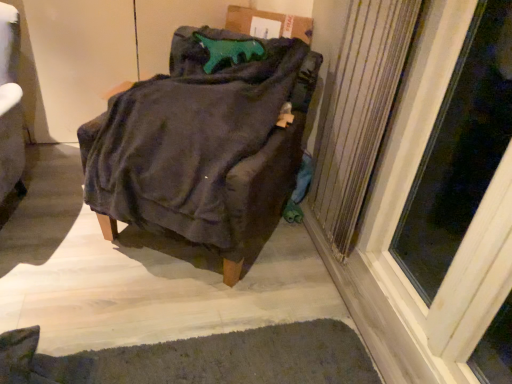
Where is `transparent glass screen door at right`? The width and height of the screenshot is (512, 384). transparent glass screen door at right is located at coordinates (459, 151).

Find the location of a particular element. The width and height of the screenshot is (512, 384). velvety dark gray chair at center is located at coordinates (203, 144).

What do you see at coordinates (226, 359) in the screenshot? I see `dark gray textured mat at lower center` at bounding box center [226, 359].

Measure the distance between point [362,356] and camera.

They are 5.07 feet apart.

Where is `metallic silver radiator at right`? The height and width of the screenshot is (384, 512). metallic silver radiator at right is located at coordinates (358, 111).

How far apart are metallic silver radiator at right and dark gray textured mat at lower center?

A distance of 82.84 centimeters exists between metallic silver radiator at right and dark gray textured mat at lower center.

From the image's perspective, which one is positioned higher, metallic silver radiator at right or dark gray textured mat at lower center?

metallic silver radiator at right appears higher in the image.

Locate an element on the screen. radiator lying on the right of dark gray textured mat at lower center is located at coordinates (358, 111).

From the picture: How different are the orientations of metallic silver radiator at right and dark gray textured mat at lower center in degrees?

0.852 degrees.

How different are the orientations of velvety dark gray chair at center and transparent glass screen door at right in degrees?

velvety dark gray chair at center and transparent glass screen door at right are facing 55.3 degrees away from each other.

From a real-world perspective, is velvety dark gray chair at center on top of transparent glass screen door at right?

Actually, velvety dark gray chair at center is physically below transparent glass screen door at right in the real world.

From the image's perspective, is velvety dark gray chair at center beneath transparent glass screen door at right?

No, from the image's perspective, velvety dark gray chair at center is not below transparent glass screen door at right.

Considering the relative positions of velvety dark gray chair at center and transparent glass screen door at right in the image provided, is velvety dark gray chair at center behind transparent glass screen door at right?

Yes, it is.

Considering the relative sizes of dark gray textured mat at lower center and metallic silver radiator at right in the image provided, is dark gray textured mat at lower center taller than metallic silver radiator at right?

In fact, dark gray textured mat at lower center may be shorter than metallic silver radiator at right.

Can you confirm if dark gray textured mat at lower center is thinner than metallic silver radiator at right?

Incorrect, the width of dark gray textured mat at lower center is not less than that of metallic silver radiator at right.

Considering the relative sizes of dark gray textured mat at lower center and metallic silver radiator at right in the image provided, is dark gray textured mat at lower center bigger than metallic silver radiator at right?

Incorrect, dark gray textured mat at lower center is not larger than metallic silver radiator at right.

The width and height of the screenshot is (512, 384). I want to click on doormat below the metallic silver radiator at right (from a real-world perspective), so click(x=226, y=359).

Image resolution: width=512 pixels, height=384 pixels. I want to click on furniture on the left of dark gray textured mat at lower center, so click(203, 144).

Can you tell me how much dark gray textured mat at lower center and velvety dark gray chair at center differ in facing direction?

56.2 degrees.

From the picture: Which is more to the left, dark gray textured mat at lower center or velvety dark gray chair at center?

Positioned to the left is velvety dark gray chair at center.

From a real-world perspective, is dark gray textured mat at lower center physically below velvety dark gray chair at center?

Indeed, from a real-world perspective, dark gray textured mat at lower center is positioned beneath velvety dark gray chair at center.

Between metallic silver radiator at right and transparent glass screen door at right, which one has smaller width?

With smaller width is transparent glass screen door at right.

Which is farther, (397,3) or (490,29)?

The point (490,29) is farther.

This screenshot has width=512, height=384. I want to click on radiator that appears on the left of transparent glass screen door at right, so click(x=358, y=111).

Would you consider metallic silver radiator at right to be distant from transparent glass screen door at right?

No, there isn't a large distance between metallic silver radiator at right and transparent glass screen door at right.

Is transparent glass screen door at right at the right side of velvety dark gray chair at center?

Yes.

At what (x,y) coordinates should I click in order to perform the action: click on screen door in front of the velvety dark gray chair at center. Please return your answer as a coordinate pair (x, y). This screenshot has width=512, height=384. Looking at the image, I should click on (459, 151).

Is transparent glass screen door at right not near velvety dark gray chair at center?

No.

Which object is thinner, transparent glass screen door at right or velvety dark gray chair at center?

transparent glass screen door at right.

Is dark gray textured mat at lower center at the back of velvety dark gray chair at center?

No.

Visually, is velvety dark gray chair at center positioned to the left or to the right of dark gray textured mat at lower center?

From the image, it's evident that velvety dark gray chair at center is to the left of dark gray textured mat at lower center.

Does velvety dark gray chair at center have a smaller size compared to dark gray textured mat at lower center?

No.

Is velvety dark gray chair at center wider than dark gray textured mat at lower center?

In fact, velvety dark gray chair at center might be narrower than dark gray textured mat at lower center.

Find the location of a particular element. doormat that is in front of the metallic silver radiator at right is located at coordinates (226, 359).

At what (x,y) coordinates should I click in order to perform the action: click on furniture above the transparent glass screen door at right (from the image's perspective). Please return your answer as a coordinate pair (x, y). The width and height of the screenshot is (512, 384). Looking at the image, I should click on (203, 144).

Considering their positions, is dark gray textured mat at lower center positioned further to metallic silver radiator at right than transparent glass screen door at right?

dark gray textured mat at lower center is positioned further to the anchor metallic silver radiator at right.

Based on their spatial positions, is metallic silver radiator at right or dark gray textured mat at lower center further from velvety dark gray chair at center?

Based on the image, dark gray textured mat at lower center appears to be further to velvety dark gray chair at center.

Based on their spatial positions, is transparent glass screen door at right or velvety dark gray chair at center closer to metallic silver radiator at right?

transparent glass screen door at right is closer to metallic silver radiator at right.

From the image, which object appears to be farther from metallic silver radiator at right, dark gray textured mat at lower center or velvety dark gray chair at center?

Among the two, dark gray textured mat at lower center is located further to metallic silver radiator at right.

Estimate the real-world distances between objects in this image. Which object is further from transparent glass screen door at right, dark gray textured mat at lower center or metallic silver radiator at right?

dark gray textured mat at lower center lies further to transparent glass screen door at right than the other object.

When comparing their distances from dark gray textured mat at lower center, does velvety dark gray chair at center or transparent glass screen door at right seem closer?

velvety dark gray chair at center lies closer to dark gray textured mat at lower center than the other object.

Considering their positions, is velvety dark gray chair at center positioned closer to metallic silver radiator at right than transparent glass screen door at right?

transparent glass screen door at right is closer to metallic silver radiator at right.

Considering their positions, is velvety dark gray chair at center positioned further to dark gray textured mat at lower center than metallic silver radiator at right?

metallic silver radiator at right lies further to dark gray textured mat at lower center than the other object.

Locate an element on the screen. This screenshot has width=512, height=384. radiator between velvety dark gray chair at center and dark gray textured mat at lower center vertically is located at coordinates (358, 111).

The width and height of the screenshot is (512, 384). I want to click on doormat between velvety dark gray chair at center and transparent glass screen door at right from left to right, so click(x=226, y=359).

Where is `radiator located between velvety dark gray chair at center and transparent glass screen door at right in the left-right direction`? Image resolution: width=512 pixels, height=384 pixels. radiator located between velvety dark gray chair at center and transparent glass screen door at right in the left-right direction is located at coordinates (358, 111).

Identify the location of screen door between metallic silver radiator at right and dark gray textured mat at lower center in the up-down direction. The image size is (512, 384). (459, 151).